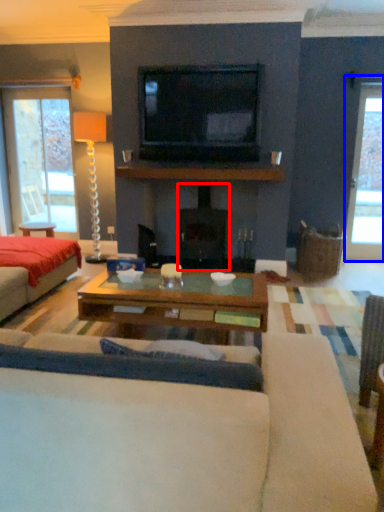
Question: Among these objects, which one is nearest to the camera, fireplace (highlighted by a red box) or window (highlighted by a blue box)?

Choices:
 (A) fireplace
 (B) window

Answer: (A)